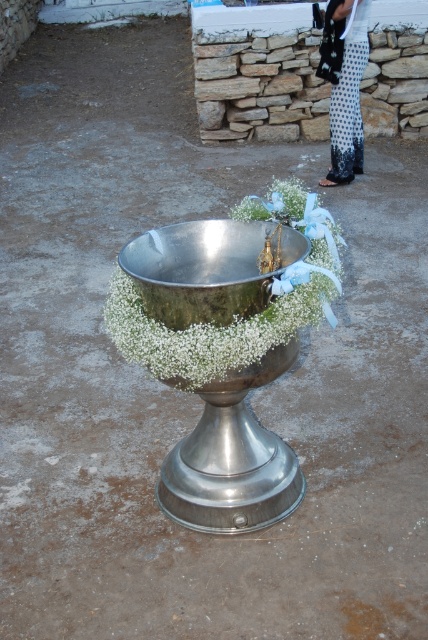
Is point (321, 264) closer to camera compared to point (330, 100)?

Yes, point (321, 264) is closer to viewer.

Between point (125, 340) and point (335, 81), which one is positioned behind?

The point (335, 81) is behind.

The height and width of the screenshot is (640, 428). In order to click on silver metallic bowl at center in this screenshot , I will do `click(234, 317)`.

Does silver metallic bowl at center appear on the left side of metallic silver bowl at center?

Incorrect, silver metallic bowl at center is not on the left side of metallic silver bowl at center.

At what (x,y) coordinates should I click in order to perform the action: click on silver metallic bowl at center. Please return your answer as a coordinate pair (x, y). Looking at the image, I should click on (234, 317).

What do you see at coordinates (234, 317) in the screenshot?
I see `silver metallic bowl at center` at bounding box center [234, 317].

Where is `silver metallic bowl at center`? silver metallic bowl at center is located at coordinates (234, 317).

Who is positioned more to the left, metallic silver bowl at center or polka dot fabric pants at right?

From the viewer's perspective, metallic silver bowl at center appears more on the left side.

Is point (261, 300) farther from viewer compared to point (348, 44)?

No, it is in front of (348, 44).

Identify the location of metallic silver bowl at center. The height and width of the screenshot is (640, 428). (208, 268).